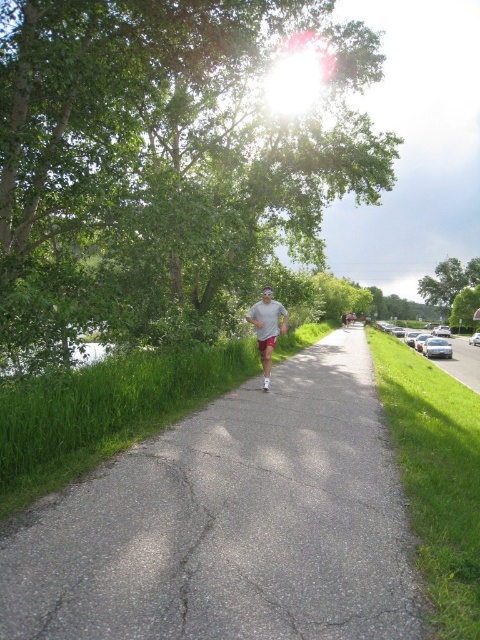
Find the location of a particular element. The height and width of the screenshot is (640, 480). green leafy tree at center is located at coordinates (165, 161).

Looking at this image, is green leafy tree at center to the right of gray cotton shirt at center from the viewer's perspective?

No, green leafy tree at center is not to the right of gray cotton shirt at center.

This screenshot has height=640, width=480. What do you see at coordinates (165, 161) in the screenshot?
I see `green leafy tree at center` at bounding box center [165, 161].

At what (x,y) coordinates should I click in order to perform the action: click on green leafy tree at center. Please return your answer as a coordinate pair (x, y). Image resolution: width=480 pixels, height=640 pixels. Looking at the image, I should click on (165, 161).

Can you confirm if gray asphalt path at center is bigger than green leafy tree at right?

Incorrect, gray asphalt path at center is not larger than green leafy tree at right.

Who is shorter, gray asphalt path at center or green leafy tree at right?

Standing shorter between the two is gray asphalt path at center.

Between point (363, 348) and point (474, 262), which one is positioned in front?

Positioned in front is point (363, 348).

The image size is (480, 640). I want to click on gray asphalt path at center, so click(x=230, y=524).

Can you confirm if green leafy tree at center is smaller than green leafy tree at right?

No.

Who is taller, green leafy tree at center or green leafy tree at right?

green leafy tree at center

The width and height of the screenshot is (480, 640). What are the coordinates of `green leafy tree at center` in the screenshot? It's located at (165, 161).